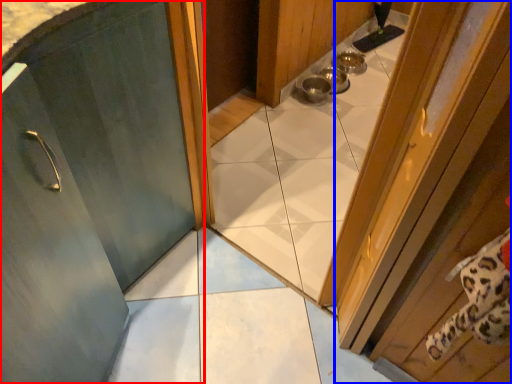
Question: Among these objects, which one is farthest to the camera, door (highlighted by a red box) or door (highlighted by a blue box)?

Choices:
 (A) door
 (B) door

Answer: (A)